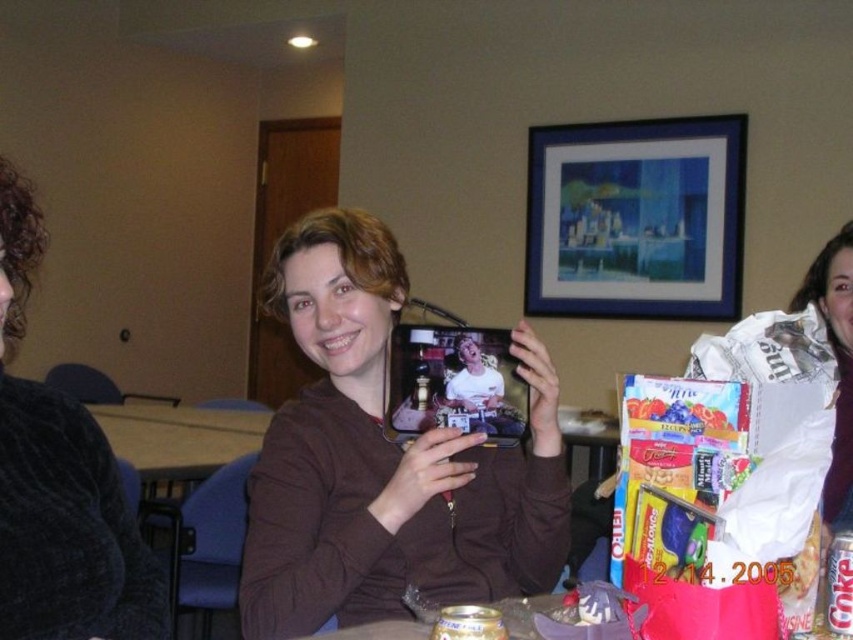
You are standing in the dining area and want to hang a new picture frame on the wall. The blue matte picture frame at upper center is currently at point 0.342, 0.747. If you want to place it at point 0.3, 0.7, will it overlap with the tablet screen?

The blue matte picture frame at upper center is currently at point (636, 218). Moving it to point (596, 192) would place it slightly to the left and lower than its current position. Since the tablet screen is displayed on the tablet held by the person in the center, which is positioned closer to the camera and central area, the new position might overlap with the tablet screen depending on the exact dimensions and orientation. However, without specific measurements of the frame and tablet screen, it is not